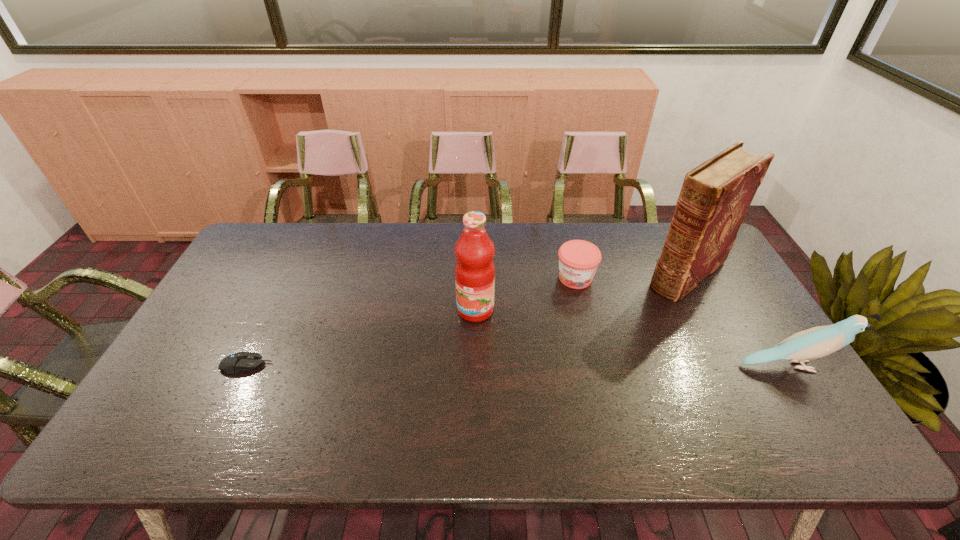
Identify the location of vacant region located 0.120m on the front label of the third object from right to left. (554, 315).

At what (x,y) coordinates should I click in order to perform the action: click on vacant space located 0.110m on the front label of the third object from right to left. Please return your answer as a coordinate pair (x, y). Looking at the image, I should click on (x=556, y=313).

Find the location of `free region located 0.160m on the spine side of the hardback book`. free region located 0.160m on the spine side of the hardback book is located at coordinates (632, 316).

At what (x,y) coordinates should I click in order to perform the action: click on free space located 0.190m on the spine side of the hardback book. Please return your answer as a coordinate pair (x, y). Looking at the image, I should click on (626, 321).

Where is `vacant space situated on the spine side of the hardback book`? Image resolution: width=960 pixels, height=540 pixels. vacant space situated on the spine side of the hardback book is located at coordinates (624, 323).

Identify the location of free location located 0.190m on the front label of the fourth shortest object. (435, 372).

I want to click on vacant area situated on the front label of the fourth shortest object, so click(x=458, y=337).

Identify the location of free space located on the front label of the fourth shortest object. The width and height of the screenshot is (960, 540). (445, 355).

In order to click on jam located at the far edge in this screenshot , I will do `click(578, 260)`.

The height and width of the screenshot is (540, 960). What are the coordinates of `hardback book located at the far edge` in the screenshot? It's located at (716, 195).